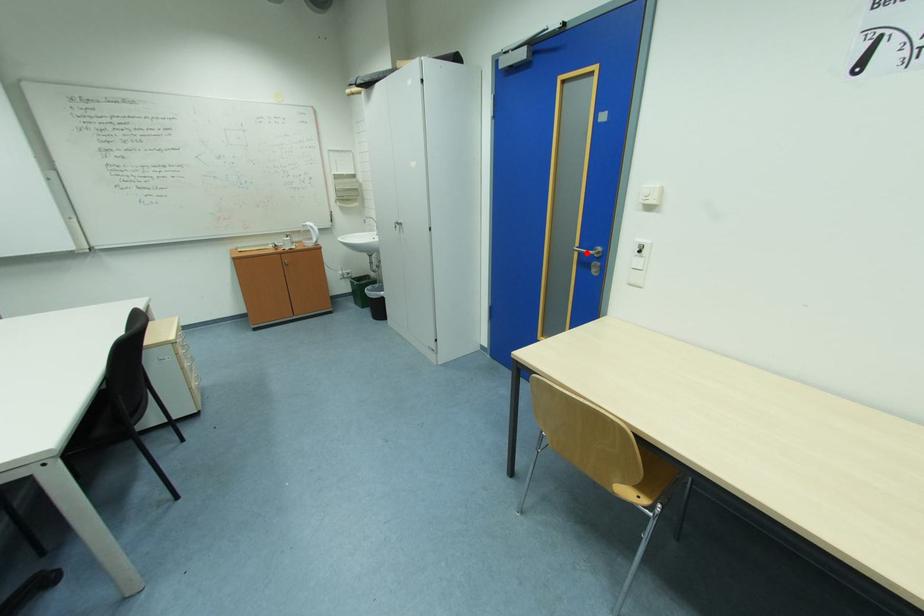
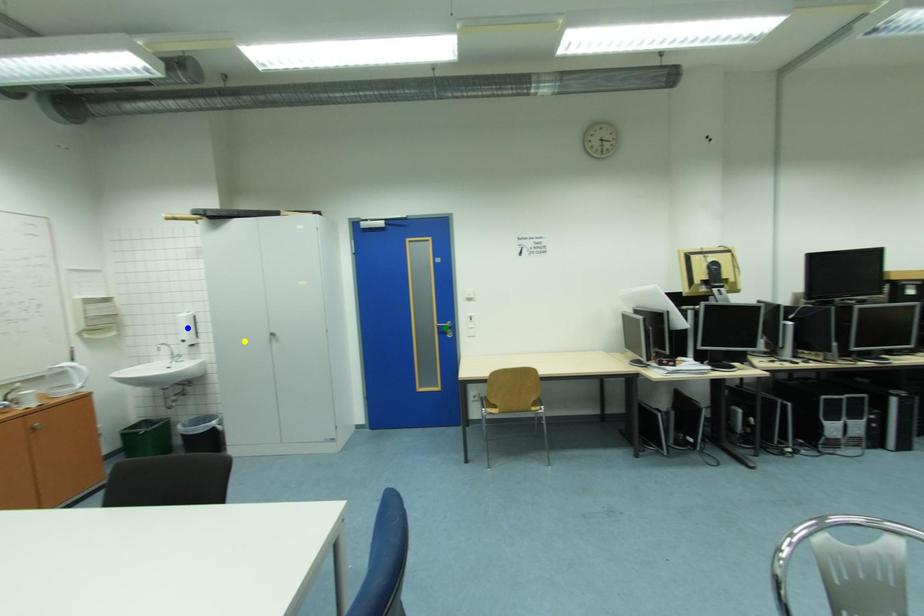
Question: I am providing you with two images of the same scene from different viewpoints. A red point is marked on the first image. You are given multiple points on the second image. In image 2, which mark is for the same physical point as the one in image 1?

Choices:
 (A) yellow point
 (B) green point
 (C) blue point

Answer: (B)